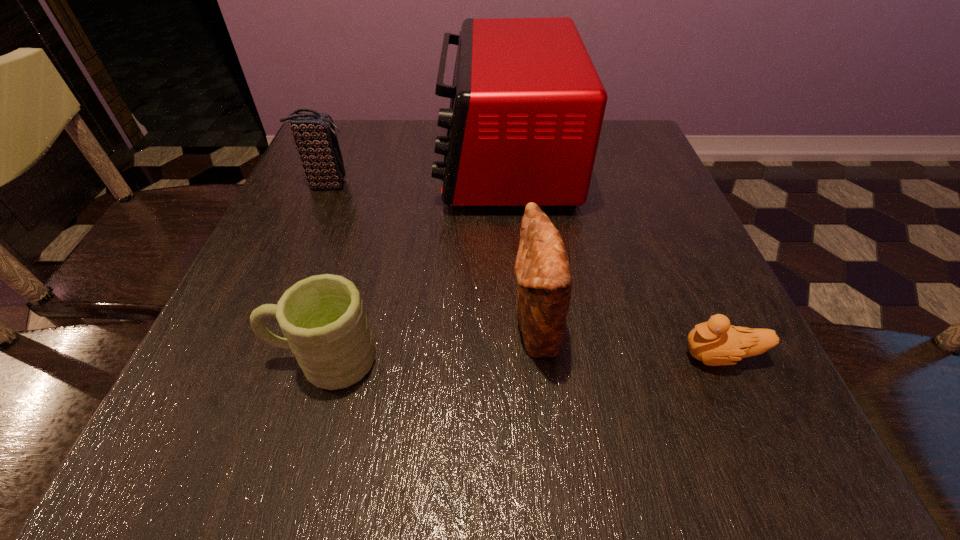
This screenshot has width=960, height=540. Identify the location of vacant point located between the toaster oven and the farther clutch bag. (416, 173).

The width and height of the screenshot is (960, 540). What are the coordinates of `free area in between the left clutch bag and the tallest object` in the screenshot? It's located at [416, 173].

Locate an element on the screen. The width and height of the screenshot is (960, 540). free space between the tallest object and the mug is located at coordinates (415, 261).

At what (x,y) coordinates should I click in order to perform the action: click on unoccupied area between the tallest object and the duckling. Please return your answer as a coordinate pair (x, y). The width and height of the screenshot is (960, 540). Looking at the image, I should click on (612, 259).

Identify the location of vacant space that is in between the right clutch bag and the farther clutch bag. (430, 256).

Identify the location of free space between the left clutch bag and the tallest object. (416, 173).

Find the location of a particular element. free space between the duckling and the mug is located at coordinates (522, 358).

The image size is (960, 540). In order to click on object that ranks as the second closest to the left clutch bag in this screenshot , I will do `click(322, 318)`.

Identify which object is located as the third nearest to the toaster oven. Please provide its 2D coordinates. Your answer should be formatted as a tuple, i.e. [(x, y)], where the tuple contains the x and y coordinates of a point satisfying the conditions above.

[(322, 318)]